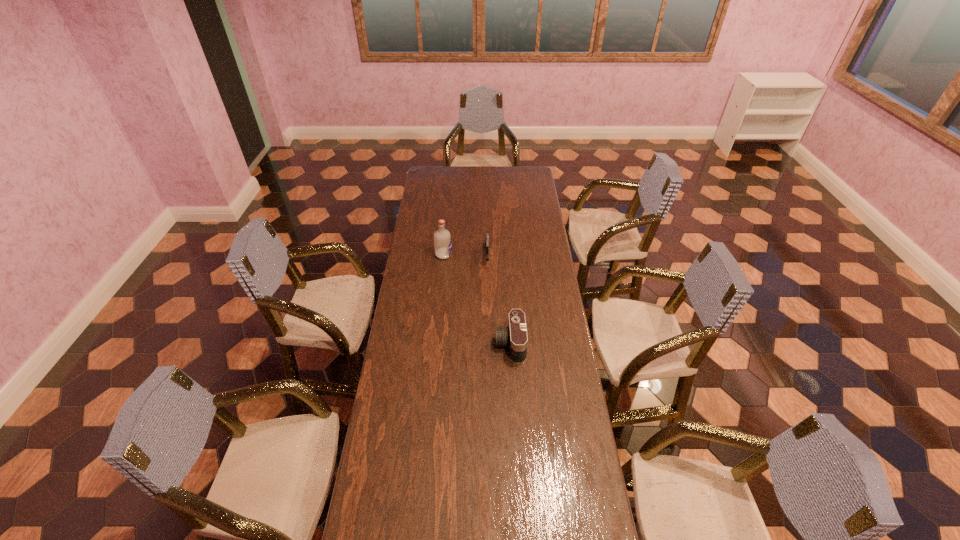
Locate an element on the screen. empty space that is in between the shortest object and the vodka is located at coordinates (466, 255).

Find the location of a particular element. empty location between the gun and the second shortest object is located at coordinates (498, 300).

Locate an element on the screen. empty space that is in between the second object from left to right and the rightmost object is located at coordinates (498, 300).

Locate which object is the closest to the tallest object. Please provide its 2D coordinates. Your answer should be formatted as a tuple, i.e. [(x, y)], where the tuple contains the x and y coordinates of a point satisfying the conditions above.

[(487, 248)]

The width and height of the screenshot is (960, 540). In order to click on object that stands as the closest to the second object from right to left in this screenshot , I will do `click(442, 239)`.